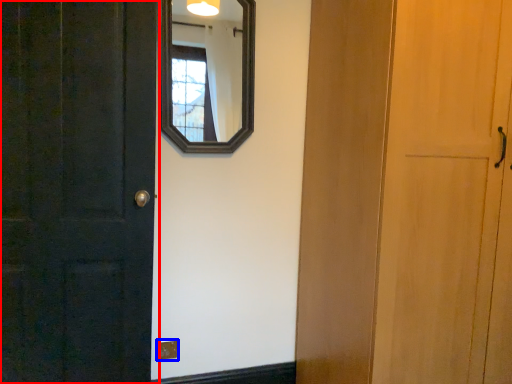
Question: Which point is further to the camera, door (highlighted by a red box) or electric outlet (highlighted by a blue box)?

Choices:
 (A) door
 (B) electric outlet

Answer: (B)